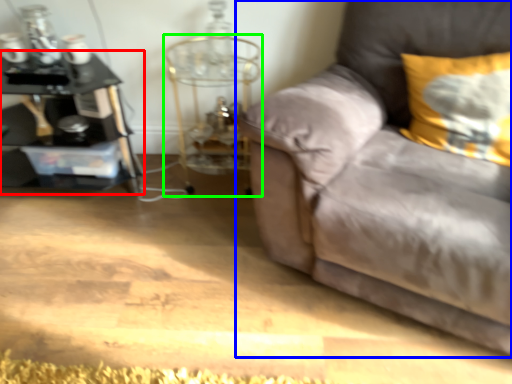
Question: Which is nearer to the table (highlighted by a red box)? studio couch (highlighted by a blue box) or side table (highlighted by a green box).

Choices:
 (A) studio couch
 (B) side table

Answer: (B)